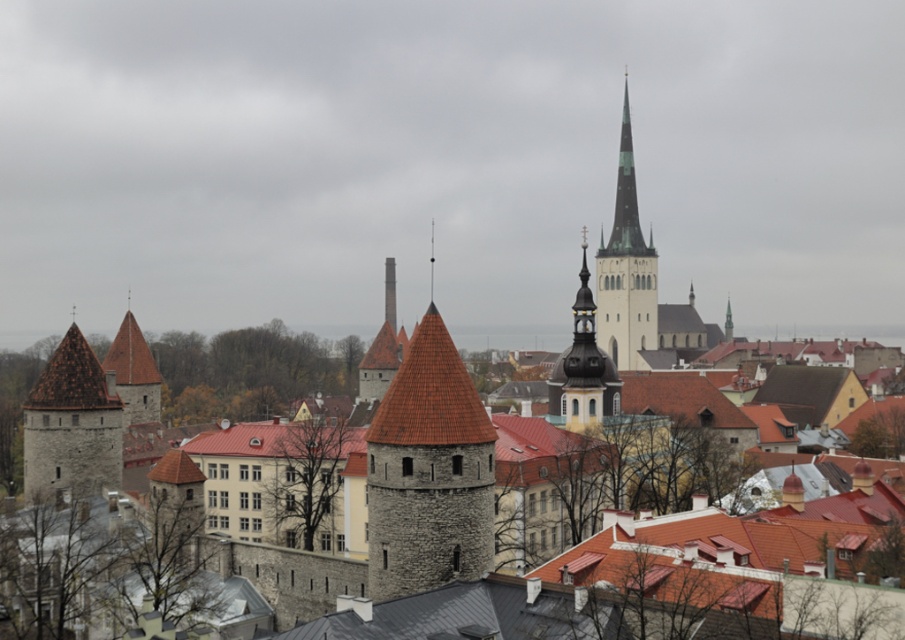
Measure the distance from greenish-gray stone spire at center-right to gold textured spire at center.

greenish-gray stone spire at center-right is 69.22 meters away from gold textured spire at center.

Describe the element at coordinates (626, 268) in the screenshot. I see `greenish-gray stone spire at center-right` at that location.

Is point (613, 356) behind point (599, 360)?

Yes, it is behind point (599, 360).

Find the location of a particular element. Image resolution: width=905 pixels, height=640 pixels. greenish-gray stone spire at center-right is located at coordinates (626, 268).

This screenshot has height=640, width=905. I want to click on stone brick tower at left, so click(71, 426).

Is point (24, 426) farther from camera compared to point (621, 240)?

No, it is in front of (621, 240).

At what (x,y) coordinates should I click in order to perform the action: click on stone brick tower at left. Please return your answer as a coordinate pair (x, y). The image size is (905, 640). Looking at the image, I should click on (71, 426).

How much distance is there between stone brick tower at left and gold textured spire at center?

stone brick tower at left and gold textured spire at center are 146.57 feet apart from each other.

Locate an element on the screen. This screenshot has height=640, width=905. stone brick tower at left is located at coordinates (71, 426).

Where is `stone brick tower at left`? The height and width of the screenshot is (640, 905). stone brick tower at left is located at coordinates (71, 426).

Locate an element on the screen. This screenshot has width=905, height=640. stone brick tower at left is located at coordinates (71, 426).